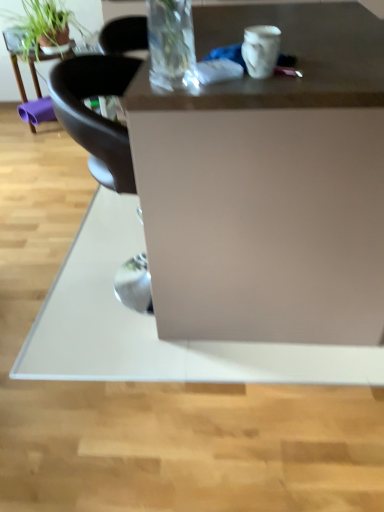
Image resolution: width=384 pixels, height=512 pixels. I want to click on free location in front of matte white desk at center, so click(216, 413).